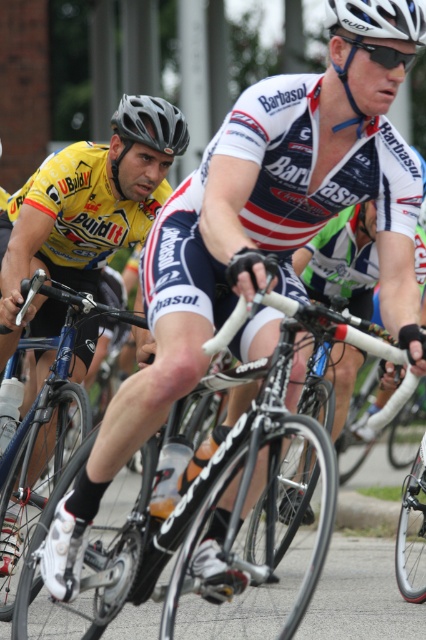
You are a photographer positioned at the side of the road during a cycling race. You want to capture a photo of both the shiny black frame at center and the shiny blue frame at center in the same shot. Based on their positions, which frame should appear lower in the photo?

The shiny black frame at center is below the shiny blue frame at center, so it will appear lower in the photo.

You are a photographer positioned at the side of the road during a cycling race. You want to capture a photo of the shiny black frame at center and the matte black helmet at upper center. Based on their positions, which object will appear closer to the camera in your photo?

The shiny black frame at center will appear closer to the camera because it is in front of the matte black helmet at upper center in the scene.

You are a photographer positioned at the starting line of the cycling race. You want to capture a closeup shot of the cyclist in the white jersey with red and blue accents. The camera you are using has a maximum focus range of 30 feet. Is the point at coordinates point (123, 524) within the camera focus range?

The distance between point (123, 524) and the viewer is 30.11 feet. Since the camera can only focus up to 30 feet, the point is slightly out of range.